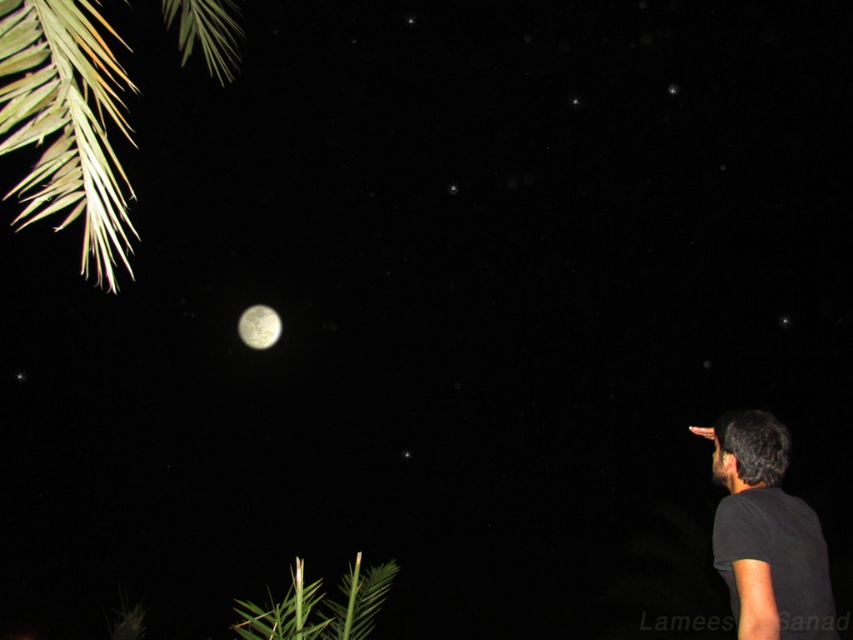
Between green leafy branch at upper left and smooth silver moon at center, which one appears on the right side from the viewer's perspective?

From the viewer's perspective, green leafy branch at upper left appears more on the right side.

Can you confirm if green leafy branch at upper left is positioned to the right of smooth silver moon at center?

Yes, green leafy branch at upper left is to the right of smooth silver moon at center.

Does point (184, 58) come closer to viewer compared to point (258, 324)?

Yes, point (184, 58) is closer to viewer.

The image size is (853, 640). I want to click on green leafy branch at upper left, so click(x=67, y=122).

Who is positioned more to the left, black matte shirt at lower right or smooth silver moon at center?

smooth silver moon at center

Is point (827, 580) positioned in front of point (264, 314)?

Yes, it is.

This screenshot has height=640, width=853. I want to click on black matte shirt at lower right, so click(x=766, y=532).

Who is positioned more to the left, green leafy branch at upper left or black matte shirt at lower right?

green leafy branch at upper left

Is green leafy branch at upper left below black matte shirt at lower right?

No.

Where is `green leafy branch at upper left`? The image size is (853, 640). green leafy branch at upper left is located at coordinates (67, 122).

The image size is (853, 640). Find the location of `green leafy branch at upper left`. green leafy branch at upper left is located at coordinates pyautogui.click(x=67, y=122).